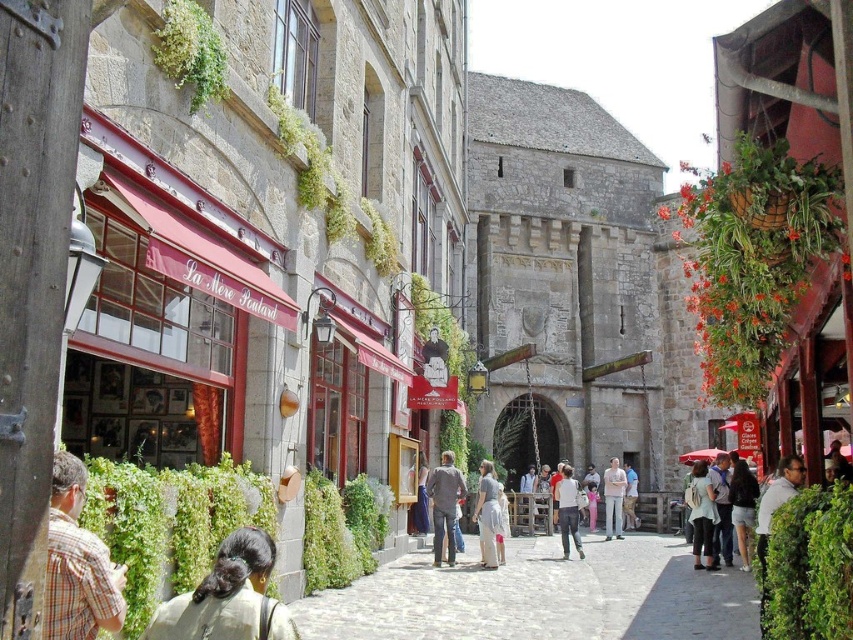
Question: Where is dark gray fabric jacket at center located in relation to light blue denim jacket at center in the image?

Choices:
 (A) left
 (B) right

Answer: (A)

Question: Which object is the farthest from the plaid shirt at lower left?

Choices:
 (A) light pink cotton shirt at center
 (B) light blue fabric dress at lower right
 (C) dark brown hair at lower left

Answer: (A)

Question: Which point appears closest to the camera in this image?

Choices:
 (A) (490, 545)
 (B) (746, 570)
 (C) (598, 570)

Answer: (B)

Question: Is dark brown hair at lower left thinner than light gray cotton dress at center?

Choices:
 (A) no
 (B) yes

Answer: (B)

Question: Which object is farther from the camera taking this photo?

Choices:
 (A) light pink cotton shirt at center
 (B) dark brown hair at lower left
 (C) light brown leather jacket at center

Answer: (C)

Question: Is light blue fabric dress at lower right positioned before light gray cotton dress at center?

Choices:
 (A) yes
 (B) no

Answer: (B)